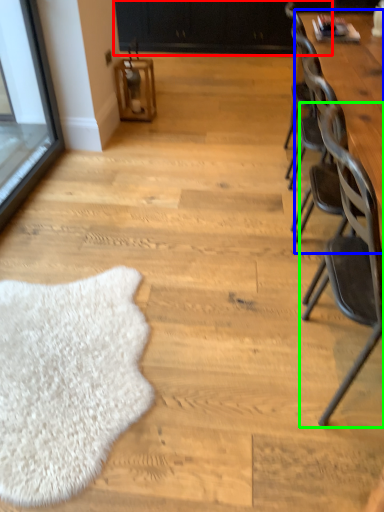
Question: Estimate the real-world distances between objects in this image. Which object is closer to dresser (highlighted by a red box), table (highlighted by a blue box) or chair (highlighted by a green box)?

Choices:
 (A) table
 (B) chair

Answer: (A)